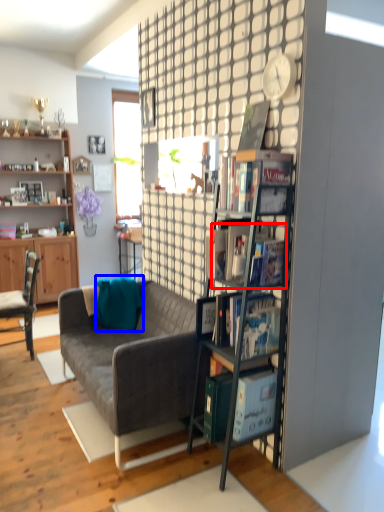
Question: Among these objects, which one is nearest to the camera, book (highlighted by a red box) or pillow (highlighted by a blue box)?

Choices:
 (A) book
 (B) pillow

Answer: (A)